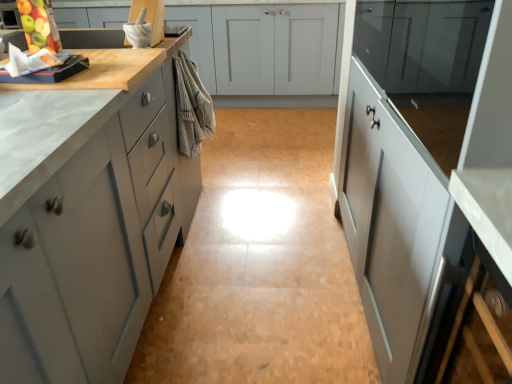
This screenshot has height=384, width=512. In order to click on glossy glass cabinet at upper right, the third cabinetry from the front in this screenshot , I will do `click(422, 43)`.

Where is `green matte apple at upper left`? green matte apple at upper left is located at coordinates click(35, 25).

What are the coordinates of `matte gray cabinets at center, placed as the 4th cabinetry when sorted from front to back` in the screenshot? It's located at (266, 51).

What is the approximate height of matte gray cabinets at center, marked as the 1th cabinetry in a back-to-front arrangement?

It is 35.70 inches.

I want to click on glossy white cabinet at right, which is the 2th cabinetry from front to back, so click(x=417, y=162).

Identify the location of beige textured towel at center. (192, 107).

Is glossy glass cabinet at upper right, the third cabinetry from the front, oriented away from beige textured towel at center?

glossy glass cabinet at upper right, the third cabinetry from the front, is not turned away from beige textured towel at center.

Is glossy glass cabinet at upper right, the third cabinetry from the front, at the right side of beige textured towel at center?

Yes.

From the image's perspective, who appears lower, glossy glass cabinet at upper right, the third cabinetry from the front, or beige textured towel at center?

beige textured towel at center appears lower in the image.

Which object is positioned more to the left, green matte apple at upper left or glossy glass cabinet at upper right, the third cabinetry from the front?

green matte apple at upper left.

From the image's perspective, does green matte apple at upper left appear higher than glossy glass cabinet at upper right, the third cabinetry from the front?

Yes, from the image's perspective, green matte apple at upper left is over glossy glass cabinet at upper right, the third cabinetry from the front.

Is glossy glass cabinet at upper right, the third cabinetry from the front, surrounded by green matte apple at upper left?

No, glossy glass cabinet at upper right, the third cabinetry from the front, is not surrounded by green matte apple at upper left.

From a real-world perspective, is green matte apple at upper left above or below glossy glass cabinet at upper right, the second cabinetry from the back?

In terms of real-world spatial position, green matte apple at upper left is above glossy glass cabinet at upper right, the second cabinetry from the back.

Are matte gray cabinets at left, which is counted as the 1th cabinetry, starting from the front, and glossy white cabinet at right, which is the 2th cabinetry from front to back, far apart?

That's not correct — matte gray cabinets at left, which is counted as the 1th cabinetry, starting from the front, is a little close to glossy white cabinet at right, which is the 2th cabinetry from front to back.

From a real-world perspective, is matte gray cabinets at left, which is the 4th cabinetry in back-to-front order, positioned under glossy white cabinet at right, acting as the 3th cabinetry starting from the back, based on gravity?

Indeed, from a real-world perspective, matte gray cabinets at left, which is the 4th cabinetry in back-to-front order, is positioned beneath glossy white cabinet at right, acting as the 3th cabinetry starting from the back.

Which object is more forward, matte gray cabinets at left, which is counted as the 1th cabinetry, starting from the front, or glossy white cabinet at right, acting as the 3th cabinetry starting from the back?

matte gray cabinets at left, which is counted as the 1th cabinetry, starting from the front, is more forward.

Where is `the 1st cabinetry directly above the matte gray cabinets at left, which is the 4th cabinetry in back-to-front order (from a real-world perspective)`? The height and width of the screenshot is (384, 512). the 1st cabinetry directly above the matte gray cabinets at left, which is the 4th cabinetry in back-to-front order (from a real-world perspective) is located at coordinates (417, 162).

Which is farther, (49, 30) or (454, 23)?

Point (49, 30)

Could you tell me if green matte apple at upper left is facing glossy white cabinet at right, which is the 2th cabinetry from front to back?

Yes, green matte apple at upper left is facing glossy white cabinet at right, which is the 2th cabinetry from front to back.

Which object is positioned more to the right, green matte apple at upper left or glossy white cabinet at right, acting as the 3th cabinetry starting from the back?

glossy white cabinet at right, acting as the 3th cabinetry starting from the back, is more to the right.

Between green matte apple at upper left and glossy white cabinet at right, acting as the 3th cabinetry starting from the back, which one has smaller size?

Answer: With smaller size is green matte apple at upper left.

Looking at the image, does beige textured towel at center seem bigger or smaller compared to glossy white cabinet at right, acting as the 3th cabinetry starting from the back?

beige textured towel at center is smaller than glossy white cabinet at right, acting as the 3th cabinetry starting from the back.

Is beige textured towel at center with glossy white cabinet at right, which is the 2th cabinetry from front to back?

beige textured towel at center is not next to glossy white cabinet at right, which is the 2th cabinetry from front to back, and they're not touching.

Which object is thinner, beige textured towel at center or glossy white cabinet at right, acting as the 3th cabinetry starting from the back?

Thinner between the two is beige textured towel at center.

Considering the positions of objects green matte apple at upper left and matte gray cabinets at left, which is counted as the 1th cabinetry, starting from the front, in the image provided, who is more to the left, green matte apple at upper left or matte gray cabinets at left, which is counted as the 1th cabinetry, starting from the front,?

matte gray cabinets at left, which is counted as the 1th cabinetry, starting from the front.

What's the angular difference between green matte apple at upper left and matte gray cabinets at left, which is the 4th cabinetry in back-to-front order,'s facing directions?

There is a 177-degree angle between the facing directions of green matte apple at upper left and matte gray cabinets at left, which is the 4th cabinetry in back-to-front order.

From the image's perspective, which is below, green matte apple at upper left or matte gray cabinets at left, which is the 4th cabinetry in back-to-front order?

matte gray cabinets at left, which is the 4th cabinetry in back-to-front order.

From the image's perspective, is glossy glass cabinet at upper right, the third cabinetry from the front, beneath matte gray cabinets at left, which is the 4th cabinetry in back-to-front order?

Incorrect, from the image's perspective, glossy glass cabinet at upper right, the third cabinetry from the front, is higher than matte gray cabinets at left, which is the 4th cabinetry in back-to-front order.

Looking at this image, looking at their sizes, would you say glossy glass cabinet at upper right, the second cabinetry from the back, is wider or thinner than matte gray cabinets at left, which is counted as the 1th cabinetry, starting from the front?

glossy glass cabinet at upper right, the second cabinetry from the back, is thinner than matte gray cabinets at left, which is counted as the 1th cabinetry, starting from the front.

Are glossy glass cabinet at upper right, the second cabinetry from the back, and matte gray cabinets at left, which is the 4th cabinetry in back-to-front order, located far from each other?

No, glossy glass cabinet at upper right, the second cabinetry from the back, is not far away from matte gray cabinets at left, which is the 4th cabinetry in back-to-front order.

Who is taller, glossy glass cabinet at upper right, the second cabinetry from the back, or matte gray cabinets at left, which is the 4th cabinetry in back-to-front order?

Standing taller between the two is matte gray cabinets at left, which is the 4th cabinetry in back-to-front order.

You are a GUI agent. You are given a task and a screenshot of the screen. Output one action in this format:
    pyautogui.click(x=<x>, y=<y>)
    Task: Click on the cabinetry above the beige textured towel at center (from a real-world perspective)
    The width and height of the screenshot is (512, 384).
    Given the screenshot: What is the action you would take?
    pyautogui.click(x=422, y=43)

Where is `the 2nd cabinetry to the right when counting from the green matte apple at upper left`? the 2nd cabinetry to the right when counting from the green matte apple at upper left is located at coordinates (422, 43).

Based on their spatial positions, is beige textured towel at center or green matte apple at upper left closer to glossy glass cabinet at upper right, the second cabinetry from the back?

beige textured towel at center lies closer to glossy glass cabinet at upper right, the second cabinetry from the back, than the other object.

Based on their spatial positions, is glossy glass cabinet at upper right, the third cabinetry from the front, or matte gray cabinets at center, placed as the 4th cabinetry when sorted from front to back, further from beige textured towel at center?

matte gray cabinets at center, placed as the 4th cabinetry when sorted from front to back, is further to beige textured towel at center.

From the image, which object appears to be farther from green matte apple at upper left, matte gray cabinets at left, which is the 4th cabinetry in back-to-front order, or beige textured towel at center?

The object further to green matte apple at upper left is matte gray cabinets at left, which is the 4th cabinetry in back-to-front order.

Looking at the image, which one is located further to matte gray cabinets at center, placed as the 4th cabinetry when sorted from front to back, glossy glass cabinet at upper right, the third cabinetry from the front, or glossy white cabinet at right, which is the 2th cabinetry from front to back?

glossy glass cabinet at upper right, the third cabinetry from the front, lies further to matte gray cabinets at center, placed as the 4th cabinetry when sorted from front to back, than the other object.

Looking at the image, which one is located further to beige textured towel at center, glossy white cabinet at right, acting as the 3th cabinetry starting from the back, or matte gray cabinets at center, placed as the 4th cabinetry when sorted from front to back?

Among the two, matte gray cabinets at center, placed as the 4th cabinetry when sorted from front to back, is located further to beige textured towel at center.

When comparing their distances from glossy white cabinet at right, which is the 2th cabinetry from front to back, does green matte apple at upper left or matte gray cabinets at center, placed as the 4th cabinetry when sorted from front to back, seem closer?

green matte apple at upper left.

Based on their spatial positions, is beige textured towel at center or matte gray cabinets at left, which is the 4th cabinetry in back-to-front order, further from matte gray cabinets at center, placed as the 4th cabinetry when sorted from front to back?

matte gray cabinets at left, which is the 4th cabinetry in back-to-front order, lies further to matte gray cabinets at center, placed as the 4th cabinetry when sorted from front to back, than the other object.

Considering their positions, is beige textured towel at center positioned closer to glossy white cabinet at right, acting as the 3th cabinetry starting from the back, than glossy glass cabinet at upper right, the third cabinetry from the front?

glossy glass cabinet at upper right, the third cabinetry from the front, is positioned closer to the anchor glossy white cabinet at right, acting as the 3th cabinetry starting from the back.

I want to click on material between glossy white cabinet at right, which is the 2th cabinetry from front to back, and matte gray cabinets at center, marked as the 1th cabinetry in a back-to-front arrangement, in the front-back direction, so click(x=192, y=107).

The width and height of the screenshot is (512, 384). In order to click on material between green matte apple at upper left and glossy glass cabinet at upper right, the second cabinetry from the back, in the horizontal direction in this screenshot , I will do `click(192, 107)`.

Identify the location of material between green matte apple at upper left and glossy white cabinet at right, acting as the 3th cabinetry starting from the back, from left to right. (192, 107).

You are a GUI agent. You are given a task and a screenshot of the screen. Output one action in this format:
    pyautogui.click(x=<x>, y=<y>)
    Task: Click on the cabinetry between glossy white cabinet at right, acting as the 3th cabinetry starting from the back, and matte gray cabinets at center, placed as the 4th cabinetry when sorted from front to back, from front to back
    The image size is (512, 384).
    Given the screenshot: What is the action you would take?
    pyautogui.click(x=422, y=43)